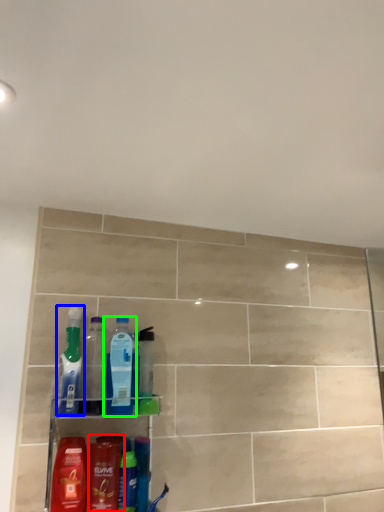
Question: Which object is the closest to the mouthwash (highlighted by a red box)? Choose among these: cleaning product (highlighted by a blue box) or bottle (highlighted by a green box).

Choices:
 (A) cleaning product
 (B) bottle

Answer: (B)